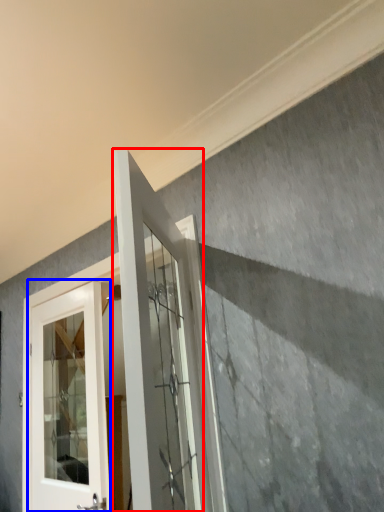
Question: Among these objects, which one is farthest to the camera, door (highlighted by a red box) or door (highlighted by a blue box)?

Choices:
 (A) door
 (B) door

Answer: (B)